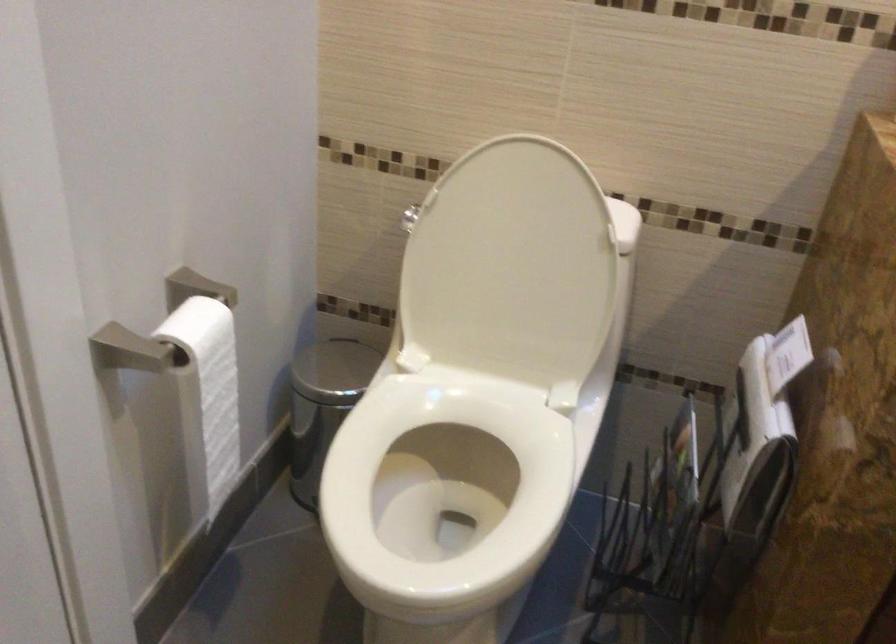
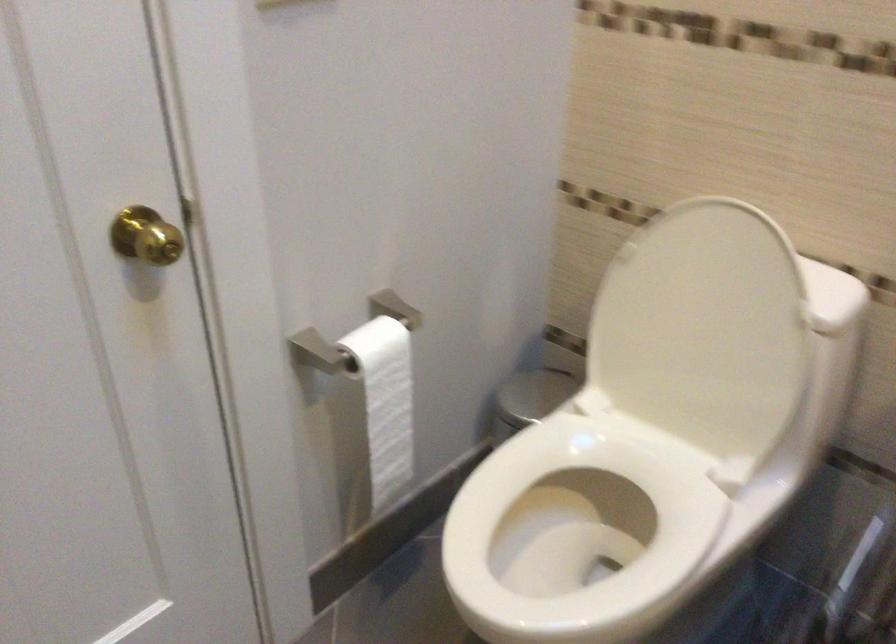
In the second image, find the point that corresponds to pixel 421 491 in the first image.

(581, 531)